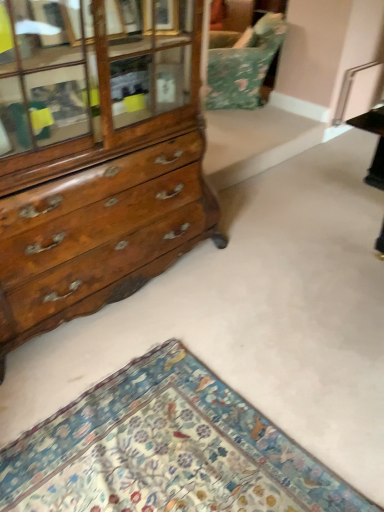
Question: Is point (127, 71) closer or farther from the camera than point (236, 37)?

Choices:
 (A) closer
 (B) farther

Answer: (A)

Question: Relative to floral fabric swivel chair at upper center, is wooden chest of drawers at left in front or behind?

Choices:
 (A) front
 (B) behind

Answer: (A)

Question: Which object is the closest to the floral fabric swivel chair at upper center?

Choices:
 (A) floral carpet at lower left
 (B) wooden chest of drawers at left

Answer: (B)

Question: Which of these objects is positioned farthest from the wooden chest of drawers at left?

Choices:
 (A) floral carpet at lower left
 (B) floral fabric swivel chair at upper center

Answer: (B)